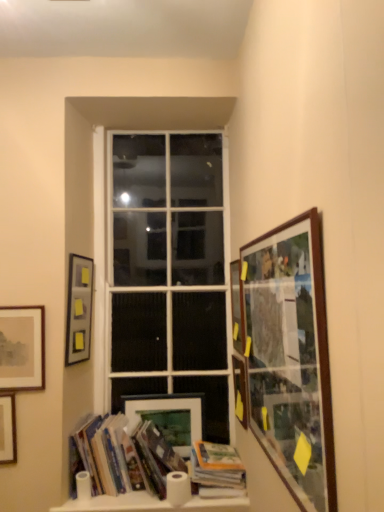
What are the coordinates of `free spot to the right of white matte toilet paper at lower left, which ranks as the 1th toilet paper in left-to-right order` in the screenshot? It's located at (119, 492).